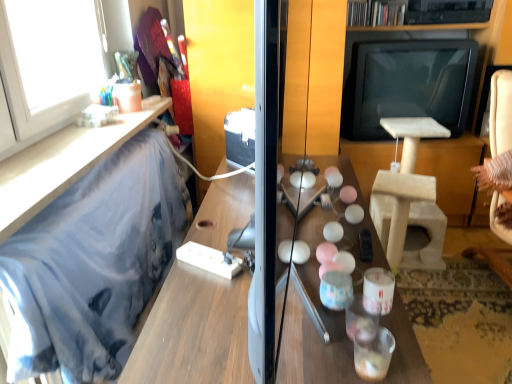
Question: From a real-world perspective, is white glossy window at upper left positioned above or below blue fabric at left, positioned as the 2th furniture in top-to-bottom order?

Choices:
 (A) above
 (B) below

Answer: (A)

Question: In the image, is white glossy window at upper left positioned in front of or behind blue fabric at left, positioned as the 2th furniture in top-to-bottom order?

Choices:
 (A) behind
 (B) front

Answer: (A)

Question: Based on their relative distances, which object is farther from the wooden table at center?

Choices:
 (A) blue fabric at left, the first furniture when ordered from bottom to top
 (B) white glossy window at upper left
 (C) beige fabric swivel chair at right
 (D) white glossy candle holder at center
 (E) blue fabric at left, the first furniture from the top

Answer: (C)

Question: Considering the real-world distances, which object is closest to the blue fabric at left, positioned as the 2th furniture in top-to-bottom order?

Choices:
 (A) white glossy window at upper left
 (B) beige fabric swivel chair at right
 (C) blue fabric at left, the second furniture in the bottom-to-top sequence
 (D) wooden table at center
 (E) white glossy candle holder at center

Answer: (C)